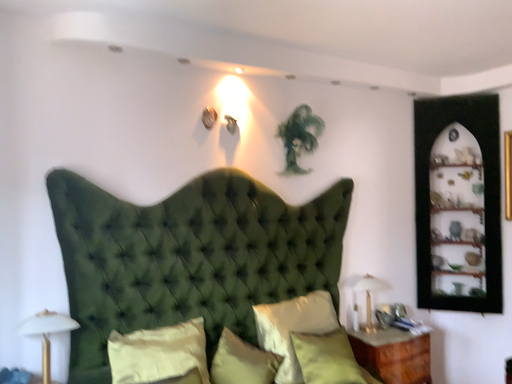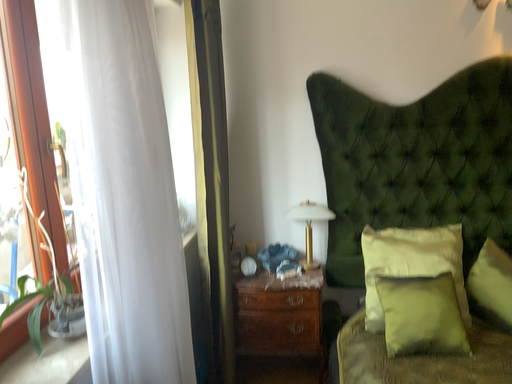
Question: Which way did the camera rotate in the video?

Choices:
 (A) rotated right
 (B) rotated left

Answer: (B)